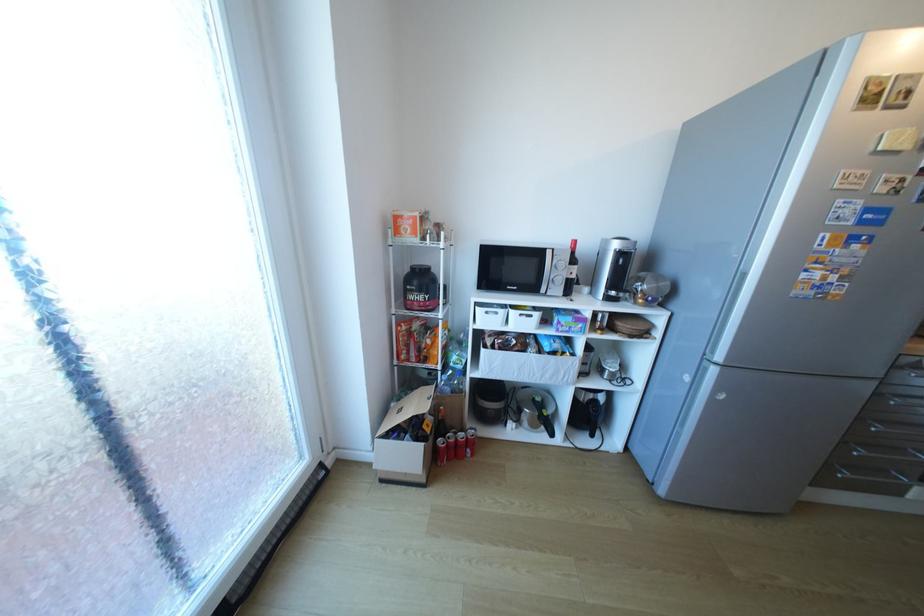
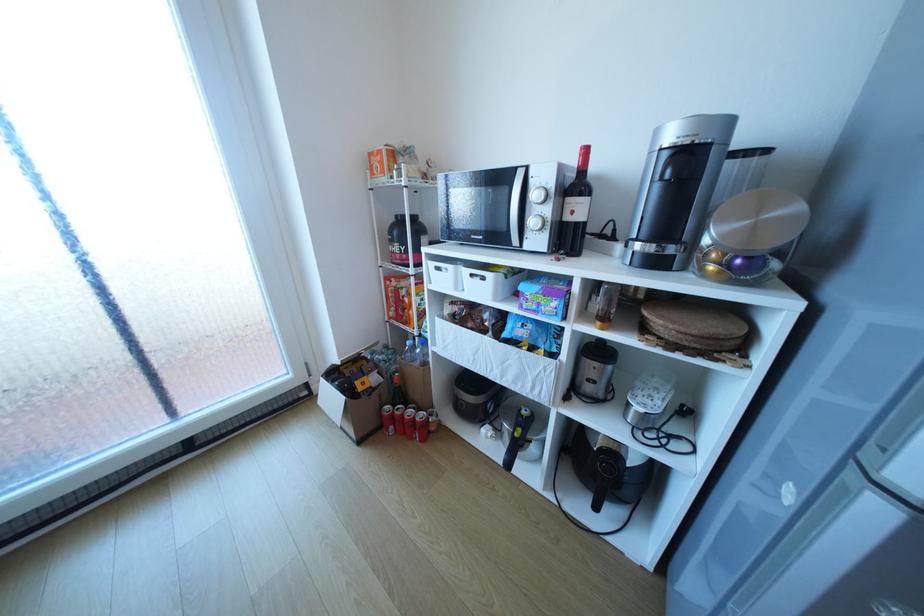
Locate, in the second image, the point that corresponds to point (529, 315) in the first image.

(481, 275)